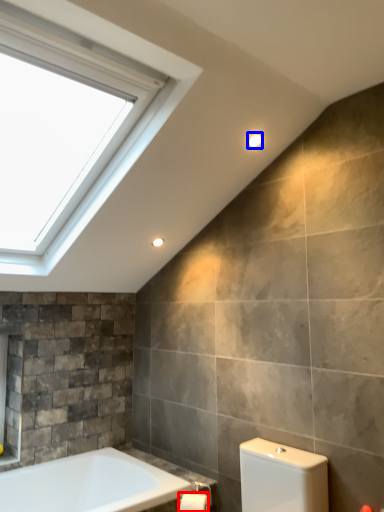
Question: Which of the following is the closest to the observer, toilet paper (highlighted by a red box) or light fixture (highlighted by a blue box)?

Choices:
 (A) toilet paper
 (B) light fixture

Answer: (A)